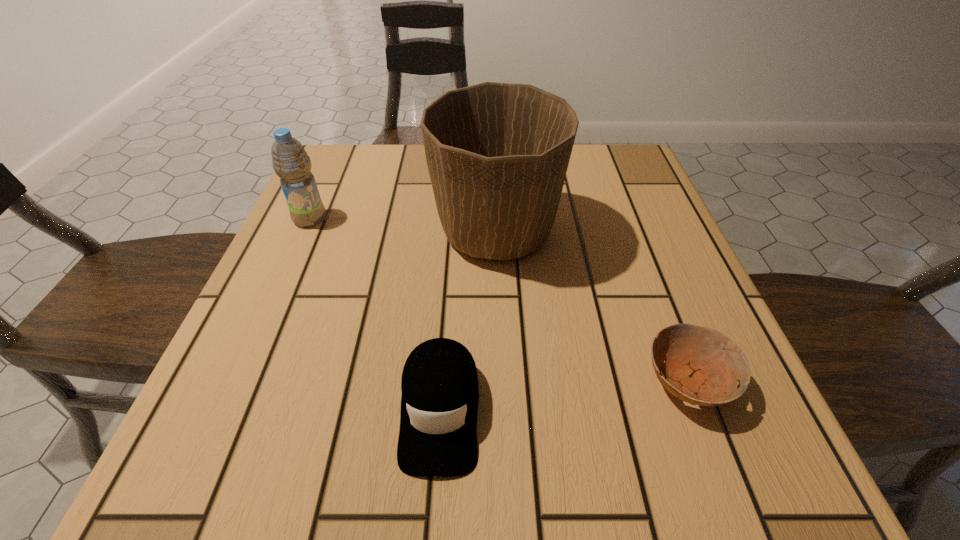
Where is `blank space that satisfies the following two spatial constraints: 1. on the front side of the water bottle; 2. on the right side of the rightmost object`? Image resolution: width=960 pixels, height=540 pixels. blank space that satisfies the following two spatial constraints: 1. on the front side of the water bottle; 2. on the right side of the rightmost object is located at coordinates (238, 382).

This screenshot has width=960, height=540. What are the coordinates of `free spot that satisfies the following two spatial constraints: 1. on the front side of the rightmost object; 2. on the left side of the tallest object` in the screenshot? It's located at (502, 382).

At what (x,y) coordinates should I click in order to perform the action: click on free space that satisfies the following two spatial constraints: 1. on the front side of the bowl; 2. on the left side of the tallest object. Please return your answer as a coordinate pair (x, y). The height and width of the screenshot is (540, 960). Looking at the image, I should click on (502, 382).